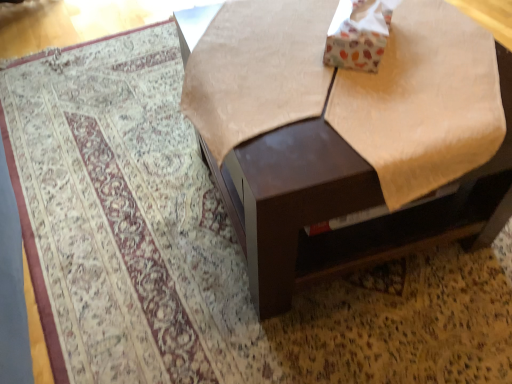
Identify the location of white cardboard box at upper right. This screenshot has width=512, height=384. (358, 34).

What do you see at coordinates (358, 34) in the screenshot? I see `white cardboard box at upper right` at bounding box center [358, 34].

The image size is (512, 384). What do you see at coordinates (345, 205) in the screenshot?
I see `brown glossy table at upper center` at bounding box center [345, 205].

Identify the location of brown glossy table at upper center. This screenshot has height=384, width=512. (345, 205).

The image size is (512, 384). Find the location of `white cardboard box at upper right`. white cardboard box at upper right is located at coordinates (358, 34).

Is brown glossy table at upper center to the left of white cardboard box at upper right from the viewer's perspective?

Indeed, brown glossy table at upper center is positioned on the left side of white cardboard box at upper right.

In the image, is brown glossy table at upper center positioned in front of or behind white cardboard box at upper right?

brown glossy table at upper center is positioned closer to the viewer than white cardboard box at upper right.

Which is nearer, (501,205) or (333,48)?

The point (333,48) is in front.

From the image's perspective, does brown glossy table at upper center appear lower than white cardboard box at upper right?

Yes, from the image's perspective, brown glossy table at upper center is below white cardboard box at upper right.

From a real-world perspective, which object rests below the other?

brown glossy table at upper center is physically lower.

In terms of width, does brown glossy table at upper center look wider or thinner when compared to white cardboard box at upper right?

brown glossy table at upper center is wider than white cardboard box at upper right.

Is brown glossy table at upper center taller than white cardboard box at upper right?

Indeed, brown glossy table at upper center has a greater height compared to white cardboard box at upper right.

Considering the relative sizes of brown glossy table at upper center and white cardboard box at upper right in the image provided, is brown glossy table at upper center bigger than white cardboard box at upper right?

Yes, brown glossy table at upper center is bigger than white cardboard box at upper right.

Is brown glossy table at upper center spatially inside white cardboard box at upper right, or outside of it?

brown glossy table at upper center is not enclosed by white cardboard box at upper right.

Is the surface of brown glossy table at upper center in direct contact with white cardboard box at upper right?

No, brown glossy table at upper center is not next to white cardboard box at upper right.

Could you tell me if brown glossy table at upper center is turned towards white cardboard box at upper right?

No, brown glossy table at upper center is not oriented towards white cardboard box at upper right.

How distant is brown glossy table at upper center from white cardboard box at upper right?

The distance of brown glossy table at upper center from white cardboard box at upper right is 30.01 centimeters.

In the image, there is a brown glossy table at upper center. What are the coordinates of `cardboard box above it (from the image's perspective)` in the screenshot? It's located at (358, 34).

Is white cardboard box at upper right to the right of brown glossy table at upper center from the viewer's perspective?

Yes, white cardboard box at upper right is to the right of brown glossy table at upper center.

Is white cardboard box at upper right in front of or behind brown glossy table at upper center in the image?

Clearly, white cardboard box at upper right is behind brown glossy table at upper center.

Which is closer, (369,62) or (310,260)?

Point (369,62) is closer to the camera than point (310,260).

From the image's perspective, between white cardboard box at upper right and brown glossy table at upper center, who is located below?

brown glossy table at upper center, from the image's perspective.

From a real-world perspective, who is located higher, white cardboard box at upper right or brown glossy table at upper center?

In real-world perspective, white cardboard box at upper right is above.

Looking at their sizes, would you say white cardboard box at upper right is wider or thinner than brown glossy table at upper center?

In the image, white cardboard box at upper right appears to be more narrow than brown glossy table at upper center.

Does white cardboard box at upper right have a lesser height compared to brown glossy table at upper center?

Yes.

Is white cardboard box at upper right bigger than brown glossy table at upper center?

Incorrect, white cardboard box at upper right is not larger than brown glossy table at upper center.

Is white cardboard box at upper right outside of brown glossy table at upper center?

That's incorrect, white cardboard box at upper right is not completely outside brown glossy table at upper center.

Is white cardboard box at upper right touching brown glossy table at upper center?

No, white cardboard box at upper right is not with brown glossy table at upper center.

Is white cardboard box at upper right turned away from brown glossy table at upper center?

Yes.

I want to click on table on the left of white cardboard box at upper right, so click(x=345, y=205).

Where is `table that is on the left side of white cardboard box at upper right`? The image size is (512, 384). table that is on the left side of white cardboard box at upper right is located at coordinates (345, 205).

Locate an element on the screen. The height and width of the screenshot is (384, 512). cardboard box that appears above the brown glossy table at upper center (from a real-world perspective) is located at coordinates 358,34.